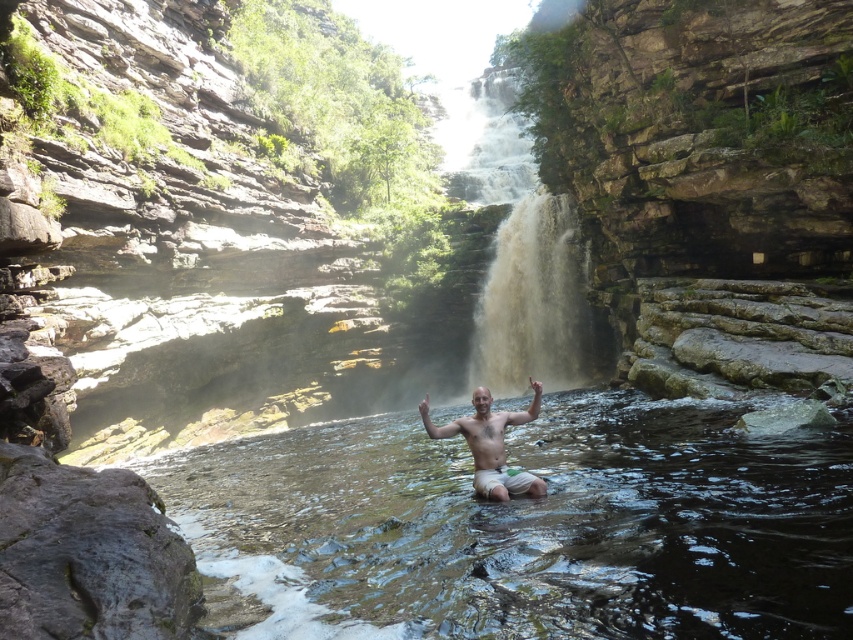
Question: In this image, where is clear water at center located relative to brown textured waterfall at center?

Choices:
 (A) right
 (B) left

Answer: (B)

Question: Which point is closer to the camera?

Choices:
 (A) brown textured waterfall at center
 (B) clear water at center

Answer: (B)

Question: Which point is farther to the camera?

Choices:
 (A) (523, 212)
 (B) (508, 493)
 (C) (323, 506)

Answer: (A)

Question: Does clear water at center have a smaller size compared to bare skin man at center?

Choices:
 (A) no
 (B) yes

Answer: (A)

Question: Does clear water at center appear under bare skin man at center?

Choices:
 (A) yes
 (B) no

Answer: (A)

Question: Which object is the closest to the brown textured waterfall at center?

Choices:
 (A) bare skin man at center
 (B) clear water at center

Answer: (B)